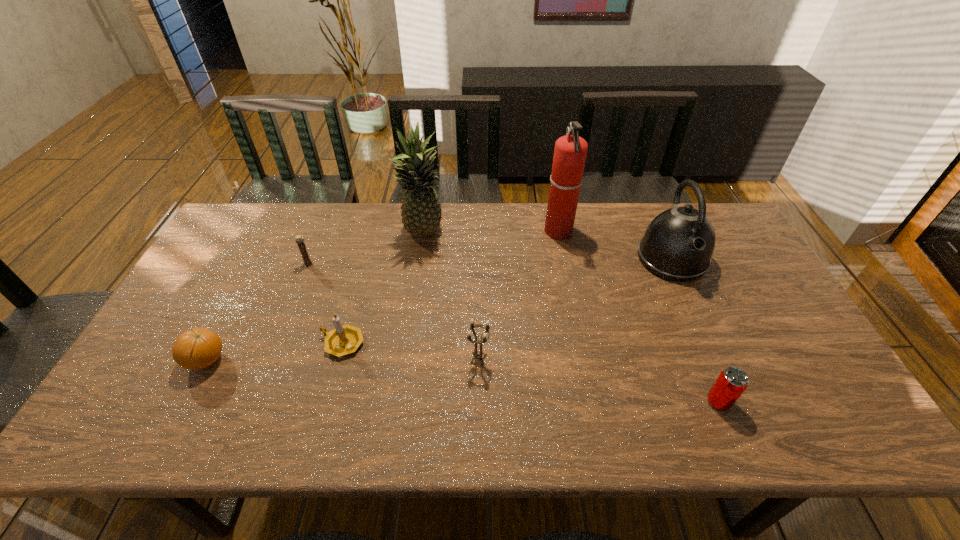
Where is `fire extinguisher`? The image size is (960, 540). fire extinguisher is located at coordinates (570, 151).

The height and width of the screenshot is (540, 960). Identify the location of the fifth object from right to left. (421, 210).

In order to click on kettle in this screenshot , I will do `click(678, 244)`.

Locate an element on the screen. The height and width of the screenshot is (540, 960). the fourth object from right to left is located at coordinates (477, 354).

Identify the location of the sixth object from right to left. The width and height of the screenshot is (960, 540). (343, 340).

Find the location of a particular element. the leftmost candle holder is located at coordinates (307, 262).

Locate an element on the screen. the farthest candle holder is located at coordinates (307, 262).

At what (x,y) coordinates should I click in order to perform the action: click on soda can. Please return your answer as a coordinate pair (x, y). The image size is (960, 540). Looking at the image, I should click on [731, 383].

Where is `orange`? The image size is (960, 540). orange is located at coordinates 198,348.

Locate an element on the screen. vacant space positioned with the nozzle and gauge on the fire extinguisher is located at coordinates 515,232.